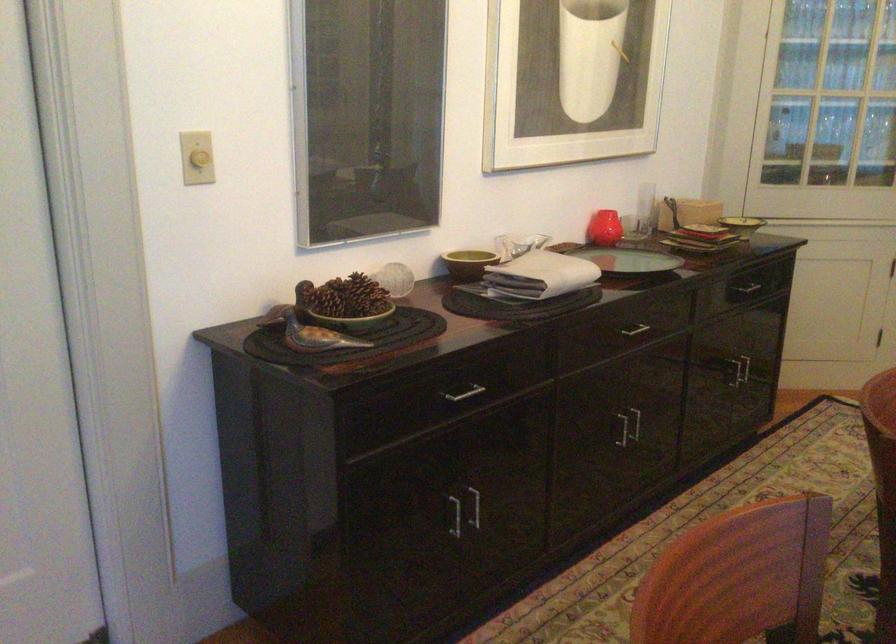
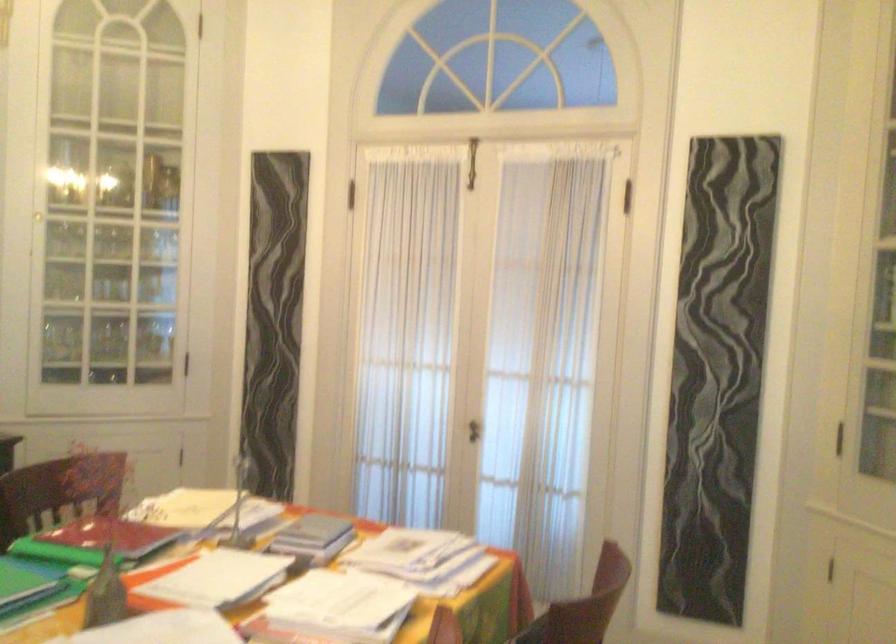
In a continuous first-person perspective shot, in which direction is the camera moving?

The cameraman walked toward right, backward.